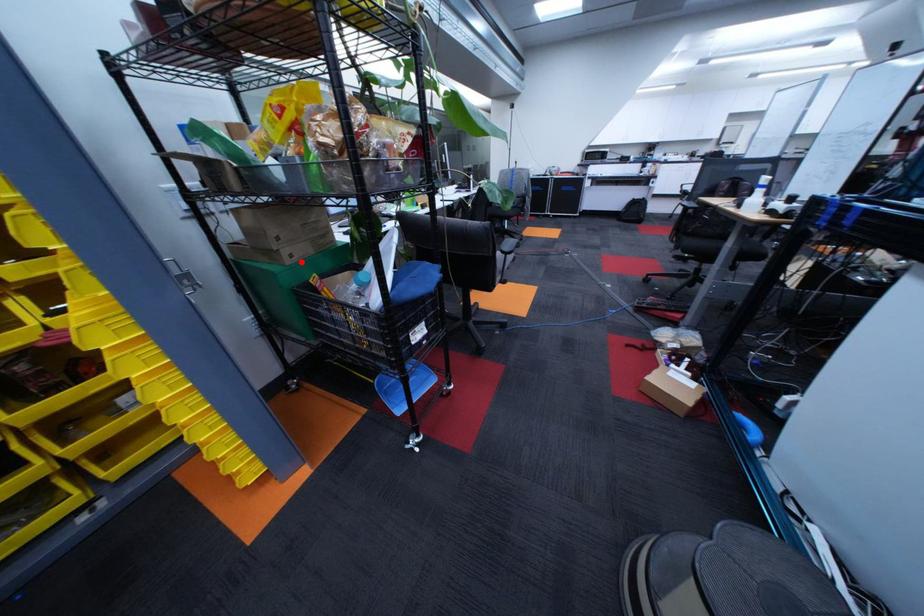
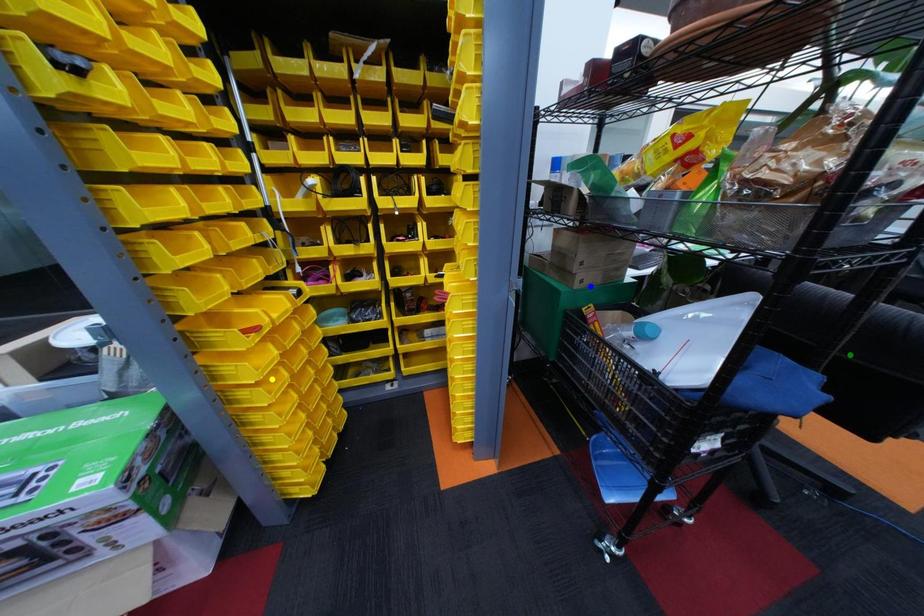
Question: I am providing you with two images of the same scene from different viewpoints. A red point is marked on the first image. You are given multiple points on the second image. In image 2, which mark is for the same physical point as the one in image 1?

Choices:
 (A) yellow point
 (B) green point
 (C) blue point

Answer: (C)